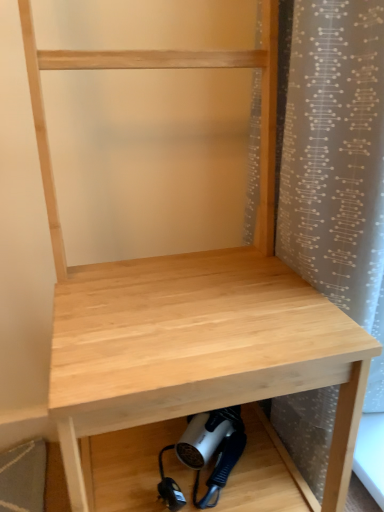
This screenshot has height=512, width=384. What do you see at coordinates (334, 152) in the screenshot?
I see `patterned fabric shower curtain at right` at bounding box center [334, 152].

The width and height of the screenshot is (384, 512). In order to click on patterned fabric shower curtain at right in this screenshot , I will do `click(334, 152)`.

At what (x,y) coordinates should I click in order to perform the action: click on patterned fabric shower curtain at right. Please return your answer as a coordinate pair (x, y). This screenshot has width=384, height=512. Looking at the image, I should click on (334, 152).